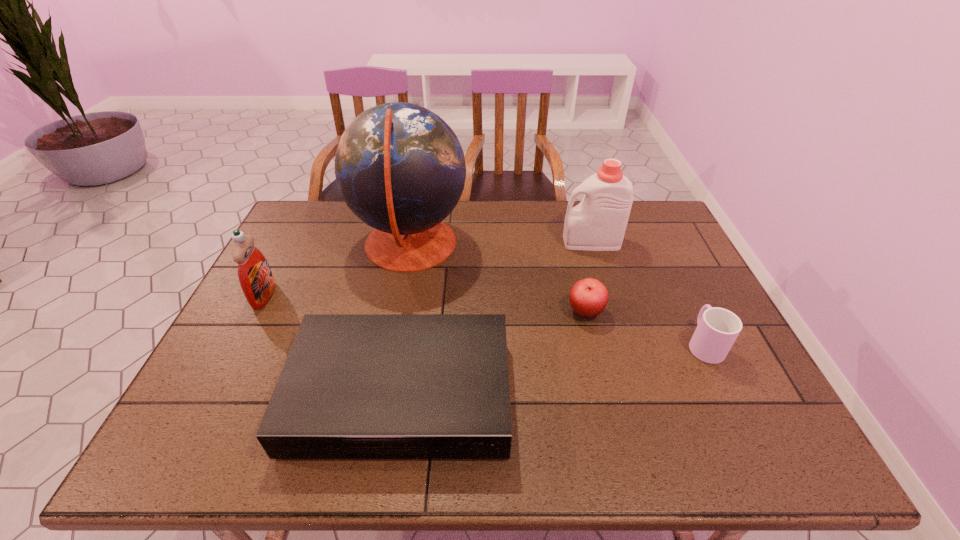
Locate an element on the screen. globe is located at coordinates (400, 168).

The width and height of the screenshot is (960, 540). In order to click on the fifth shortest object in this screenshot , I will do `click(598, 223)`.

You are a GUI agent. You are given a task and a screenshot of the screen. Output one action in this format:
    pyautogui.click(x=<x>, y=<y>)
    Task: Click on the right detergent
    Image resolution: width=960 pixels, height=540 pixels.
    Given the screenshot: What is the action you would take?
    pyautogui.click(x=598, y=223)

You are a GUI agent. You are given a task and a screenshot of the screen. Output one action in this format:
    pyautogui.click(x=<x>, y=<y>)
    Task: Click on the left detergent
    This screenshot has height=540, width=960.
    Given the screenshot: What is the action you would take?
    pyautogui.click(x=256, y=279)

You are a GUI agent. You are given a task and a screenshot of the screen. Output one action in this format:
    pyautogui.click(x=<x>, y=<y>)
    Task: Click on the leftmost object
    
    Given the screenshot: What is the action you would take?
    pyautogui.click(x=256, y=279)

Find the location of a particular element. Image resolution: width=960 pixels, height=540 pixels. cup is located at coordinates (717, 329).

This screenshot has height=540, width=960. Find the location of `apple`. apple is located at coordinates (588, 298).

Find the location of a particular element. Image resolution: width=960 pixels, height=540 pixels. CD player is located at coordinates (354, 386).

Find the location of a particular element. This screenshot has height=540, width=960. free point located 0.240m with the Americas facing the viewer on the tallest object is located at coordinates (543, 246).

At what (x,y) coordinates should I click in order to perform the action: click on vacant space located 0.110m on the handle side of the fifth shortest object. Please return your answer as a coordinate pair (x, y). The image size is (960, 540). Looking at the image, I should click on (528, 242).